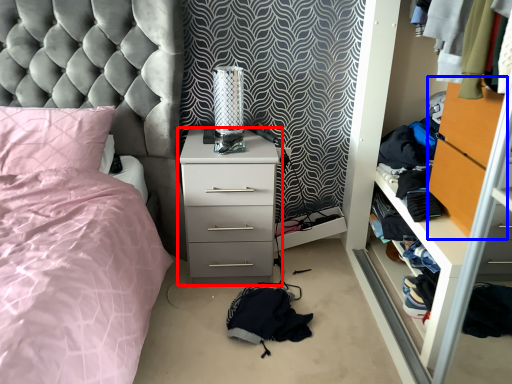
Question: Which object appears farthest to the camera in this image, chest of drawers (highlighted by a red box) or file cabinet (highlighted by a blue box)?

Choices:
 (A) chest of drawers
 (B) file cabinet

Answer: (A)